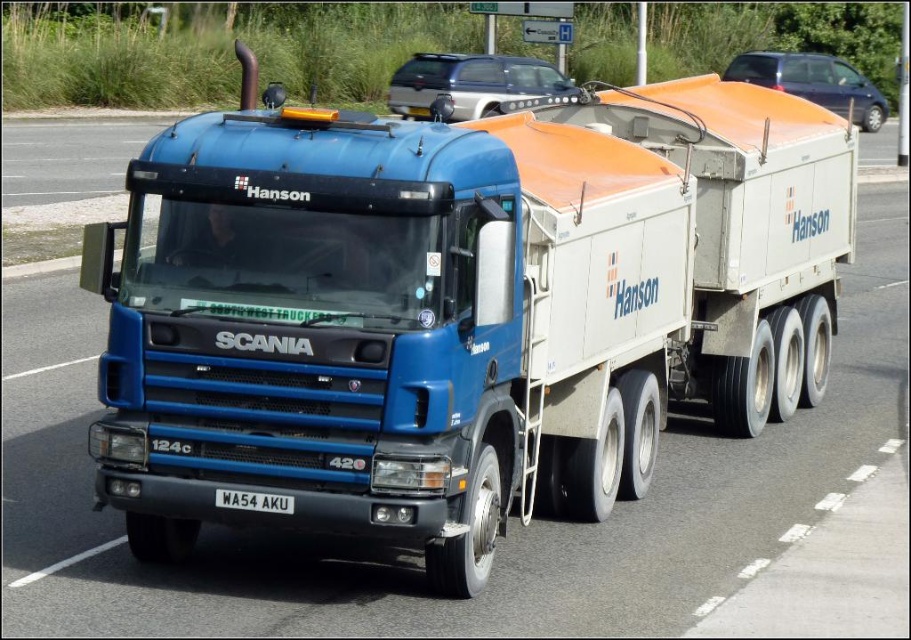
Question: Is blue metallic truck at center bigger than metallic blue van at upper right?

Choices:
 (A) yes
 (B) no

Answer: (A)

Question: Among these points, which one is farthest from the camera?

Choices:
 (A) (497, 60)
 (B) (878, 124)
 (C) (217, 502)

Answer: (B)

Question: Is metallic blue van at upper right above white metallic license plate at center?

Choices:
 (A) no
 (B) yes

Answer: (B)

Question: Which object is the farthest from the white metallic license plate at center?

Choices:
 (A) metallic blue van at upper right
 (B) blue metallic truck at center
 (C) silver metallic suv at upper center

Answer: (A)

Question: Can you confirm if silver metallic suv at upper center is positioned to the left of white metallic license plate at center?

Choices:
 (A) no
 (B) yes

Answer: (A)

Question: Which object is farther from the camera taking this photo?

Choices:
 (A) silver metallic suv at upper center
 (B) metallic blue van at upper right
 (C) white metallic license plate at center
 (D) blue metallic truck at center

Answer: (B)